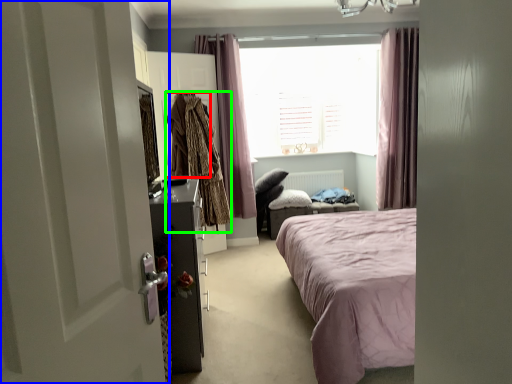
Question: Based on their relative distances, which object is farther from clothing (highlighted by a red box)? Choose from door (highlighted by a blue box) and clothing (highlighted by a green box).

Choices:
 (A) door
 (B) clothing

Answer: (A)